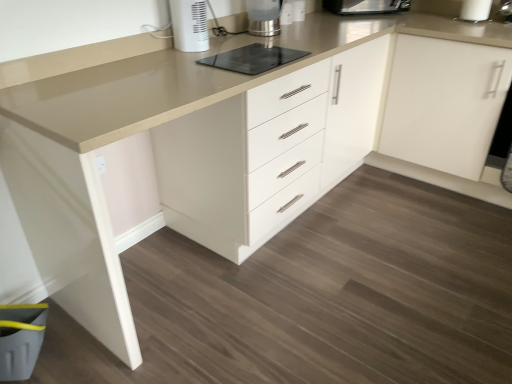
Question: Is black glass cooktop at center oriented away from metallic silver kettle at upper center, which is the 2th home appliance from left to right?

Choices:
 (A) no
 (B) yes

Answer: (A)

Question: Could you tell me if black glass cooktop at center is turned towards metallic silver kettle at upper center, which is the second home appliance from front to back?

Choices:
 (A) no
 (B) yes

Answer: (A)

Question: Can you confirm if black glass cooktop at center is positioned to the left of metallic silver kettle at upper center, the first home appliance in the right-to-left sequence?

Choices:
 (A) yes
 (B) no

Answer: (A)

Question: Considering the relative positions of black glass cooktop at center and metallic silver kettle at upper center, which is the second home appliance from front to back, in the image provided, is black glass cooktop at center to the right of metallic silver kettle at upper center, which is the second home appliance from front to back, from the viewer's perspective?

Choices:
 (A) yes
 (B) no

Answer: (B)

Question: From a real-world perspective, is black glass cooktop at center on metallic silver kettle at upper center, which is the second home appliance from front to back?

Choices:
 (A) no
 (B) yes

Answer: (A)

Question: From a real-world perspective, is white matte cabinet at upper right above or below metallic stainless steel toaster at upper center?

Choices:
 (A) above
 (B) below

Answer: (B)

Question: Is white matte cabinet at upper right in front of or behind metallic stainless steel toaster at upper center in the image?

Choices:
 (A) behind
 (B) front

Answer: (B)

Question: Based on their positions, is white matte cabinet at upper right located to the left or right of metallic stainless steel toaster at upper center?

Choices:
 (A) left
 (B) right

Answer: (B)

Question: From the image's perspective, relative to metallic stainless steel toaster at upper center, is white matte cabinet at upper right above or below?

Choices:
 (A) below
 (B) above

Answer: (A)

Question: From the image's perspective, is metallic silver kettle at upper center, the first home appliance in the right-to-left sequence, located above or below black glass cooktop at center?

Choices:
 (A) above
 (B) below

Answer: (A)

Question: Considering the positions of point (268, 31) and point (288, 54), is point (268, 31) closer or farther from the camera than point (288, 54)?

Choices:
 (A) farther
 (B) closer

Answer: (A)

Question: Considering the positions of metallic silver kettle at upper center, which is the 2th home appliance from left to right, and black glass cooktop at center in the image, is metallic silver kettle at upper center, which is the 2th home appliance from left to right, bigger or smaller than black glass cooktop at center?

Choices:
 (A) big
 (B) small

Answer: (A)

Question: Is metallic silver kettle at upper center, which is the second home appliance from front to back, to the left or to the right of black glass cooktop at center in the image?

Choices:
 (A) left
 (B) right

Answer: (B)

Question: Is black glass cooktop at center taller or shorter than metallic silver kettle at upper center, the first home appliance in the right-to-left sequence?

Choices:
 (A) short
 (B) tall

Answer: (A)

Question: From the image's perspective, is black glass cooktop at center located above or below metallic silver kettle at upper center, which is the 2th home appliance from left to right?

Choices:
 (A) below
 (B) above

Answer: (A)